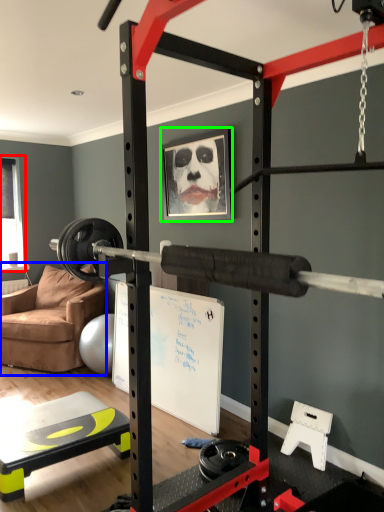
Question: Which is nearer to the window screen (highlighted by a red box)? chair (highlighted by a blue box) or picture frame (highlighted by a green box).

Choices:
 (A) chair
 (B) picture frame

Answer: (A)